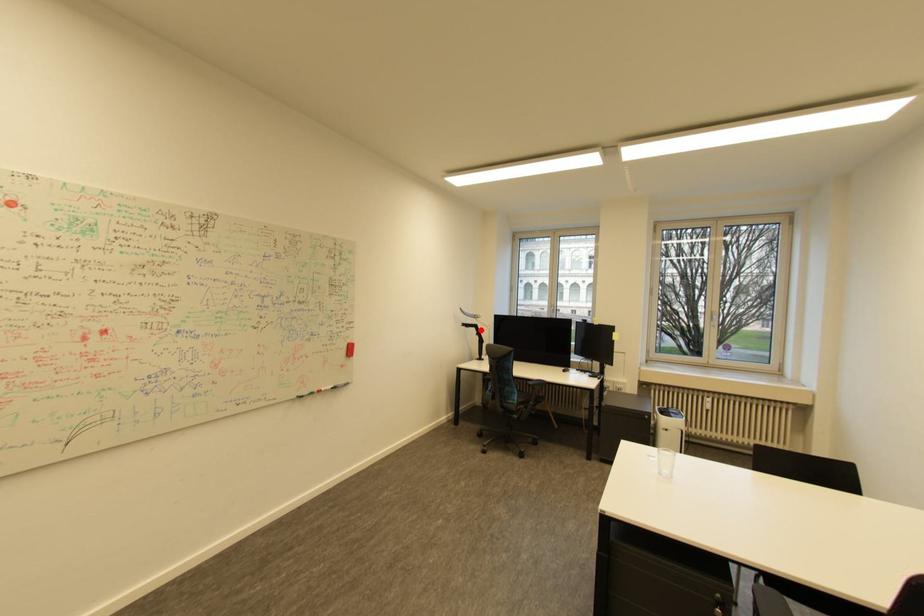
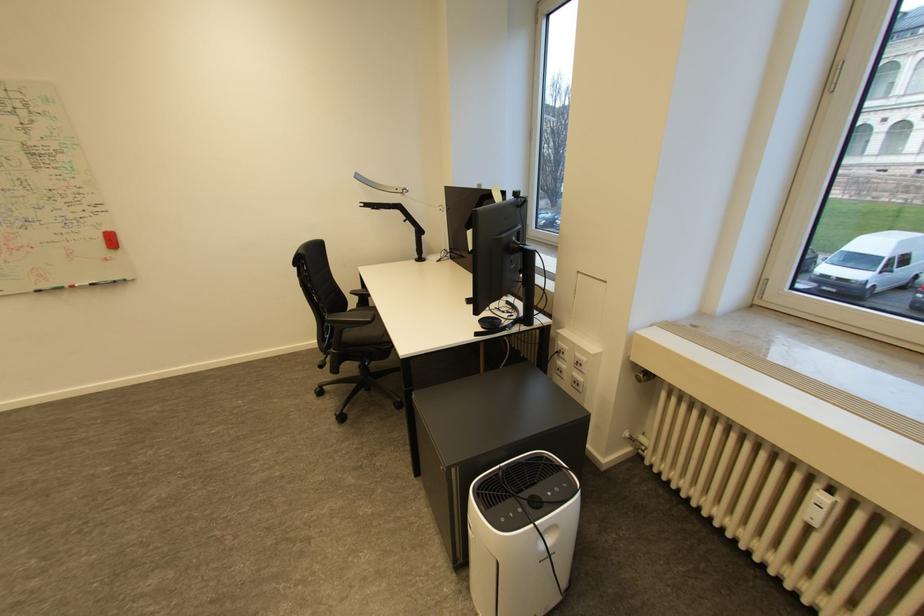
In the second image, find the point that corresponds to the highlighted location in the first image.

(405, 213)